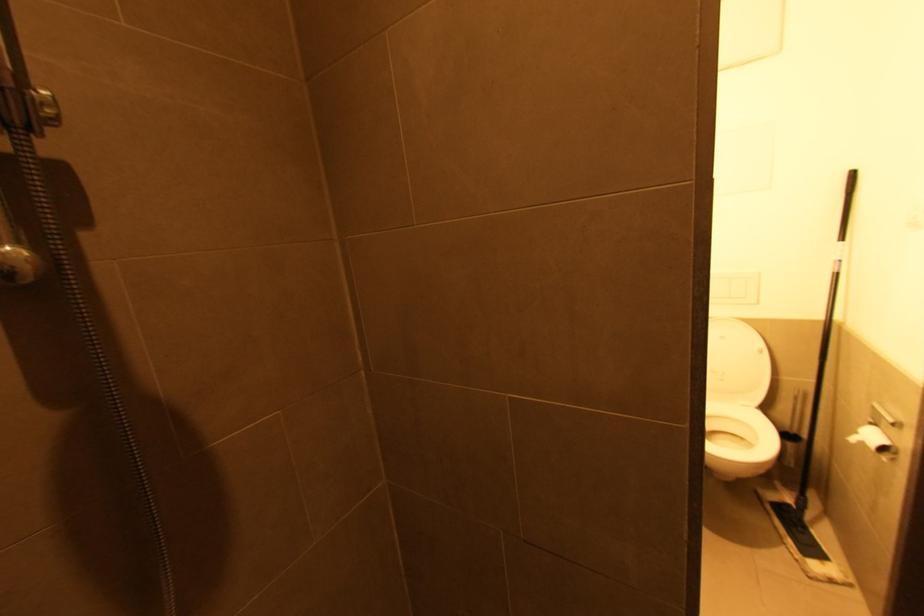
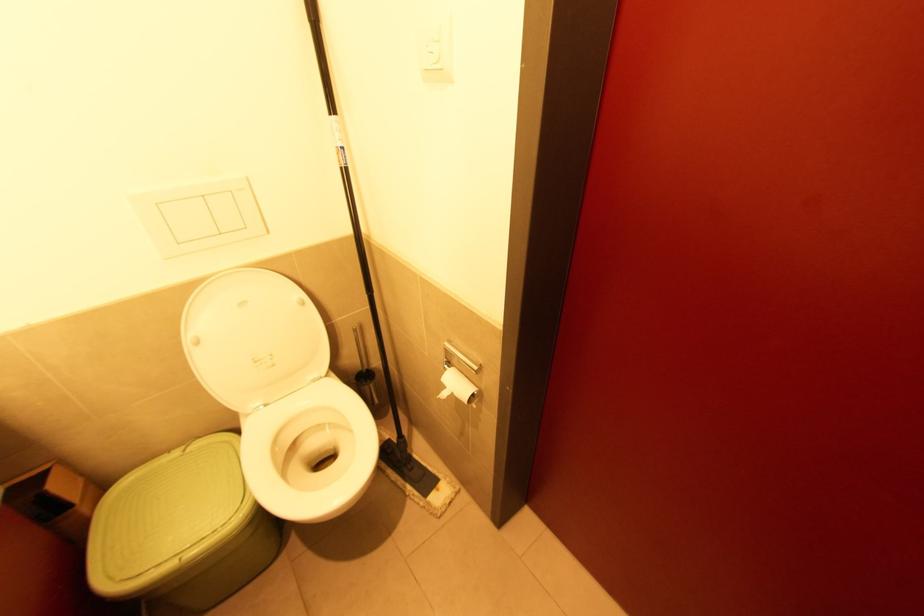
The point at (x=857, y=434) is marked in the first image. Where is the corresponding point in the second image?

(444, 387)